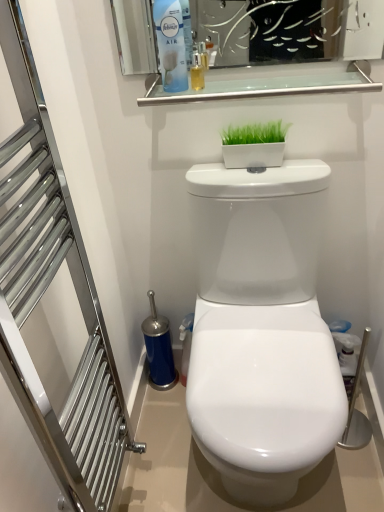
Find the location of `free space above clear glass shelf at upper center (from a real-world perspective)`. free space above clear glass shelf at upper center (from a real-world perspective) is located at coordinates (268, 80).